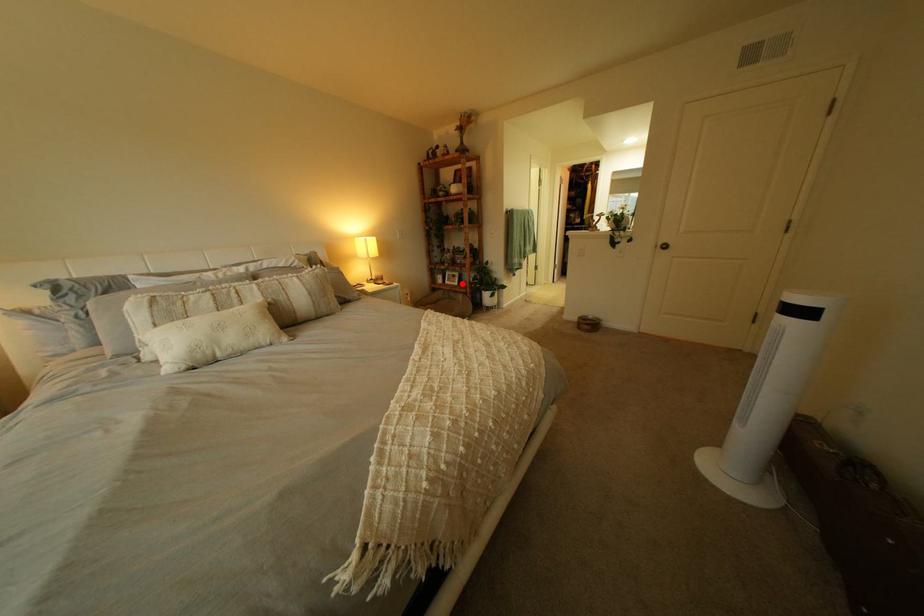
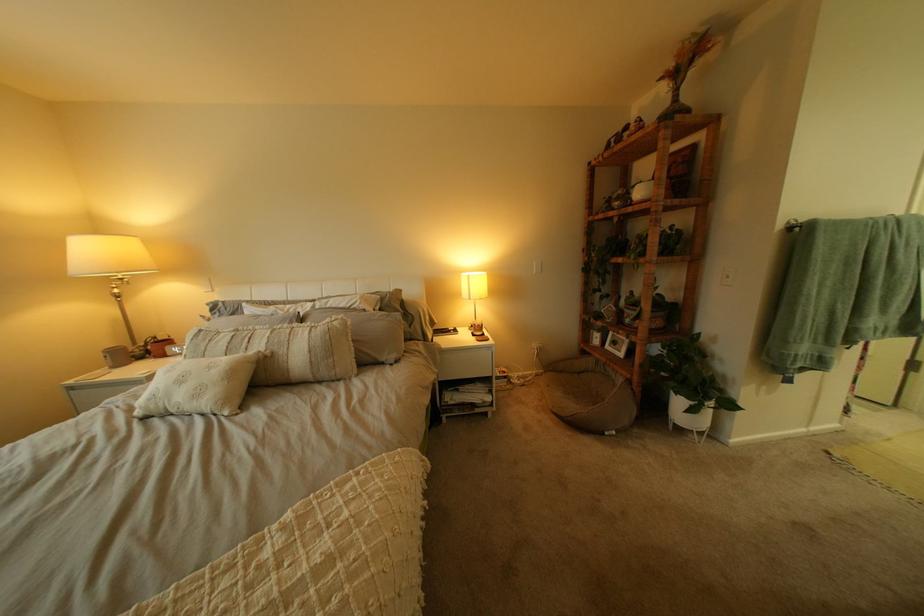
Locate, in the second image, the point that corresponds to the highlighted location in the first image.

(623, 347)